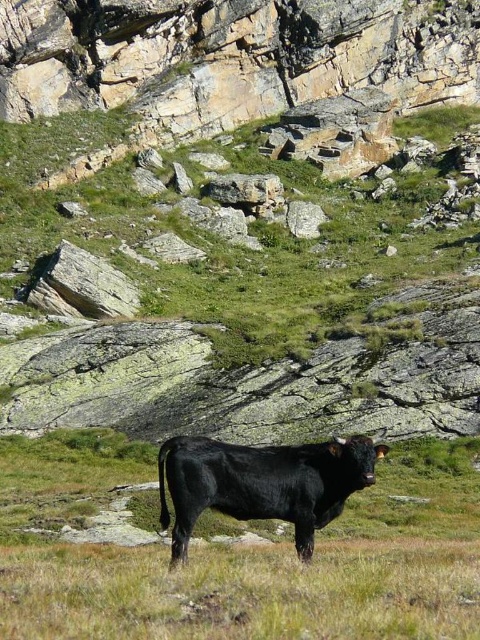
Question: Does black smooth cow at center have a lesser width compared to black smooth bull at center?

Choices:
 (A) no
 (B) yes

Answer: (A)

Question: Which point is closer to the camera?

Choices:
 (A) (116, 465)
 (B) (199, 449)

Answer: (B)

Question: Is black smooth cow at center closer to the viewer compared to black smooth bull at center?

Choices:
 (A) no
 (B) yes

Answer: (B)

Question: Which object appears closest to the camera in this image?

Choices:
 (A) black smooth bull at center
 (B) black smooth cow at center

Answer: (B)

Question: Is black smooth cow at center bigger than black smooth bull at center?

Choices:
 (A) no
 (B) yes

Answer: (B)